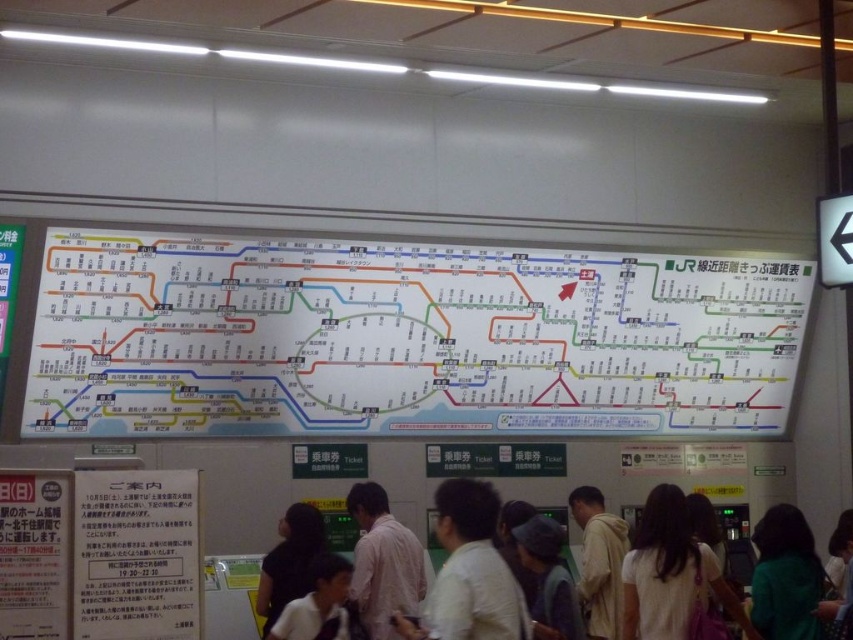
Measure the distance between light beige shirt at center and camera.

light beige shirt at center is 27.88 feet from camera.

Is light beige shirt at center thinner than white cotton shirt at lower right?

Correct, light beige shirt at center's width is less than white cotton shirt at lower right's.

Who is more distant from viewer, (450, 518) or (738, 620)?

Point (738, 620)

The height and width of the screenshot is (640, 853). Find the location of `light beige shirt at center`. light beige shirt at center is located at coordinates (469, 572).

Consider the image. Who is positioned more to the left, white paper map at center or dark gray shirt at center?

dark gray shirt at center

Can you confirm if white paper map at center is bigger than dark gray shirt at center?

Indeed, white paper map at center has a larger size compared to dark gray shirt at center.

Who is more distant from viewer, (677, 310) or (309, 557)?

The point (677, 310) is more distant.

Locate an element on the screen. white paper map at center is located at coordinates (405, 339).

Does white paper map at center have a smaller size compared to white cotton shirt at lower right?

No, white paper map at center is not smaller than white cotton shirt at lower right.

Between white paper map at center and white cotton shirt at lower right, which one is positioned higher?

Positioned higher is white paper map at center.

What are the coordinates of `white paper map at center` in the screenshot? It's located at (405, 339).

Identify the location of white paper map at center. The height and width of the screenshot is (640, 853). (405, 339).